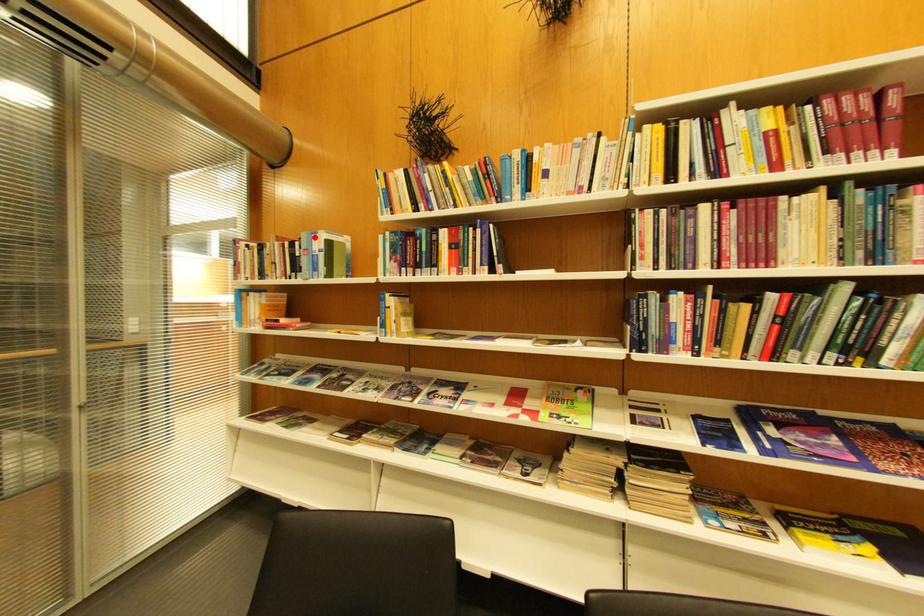
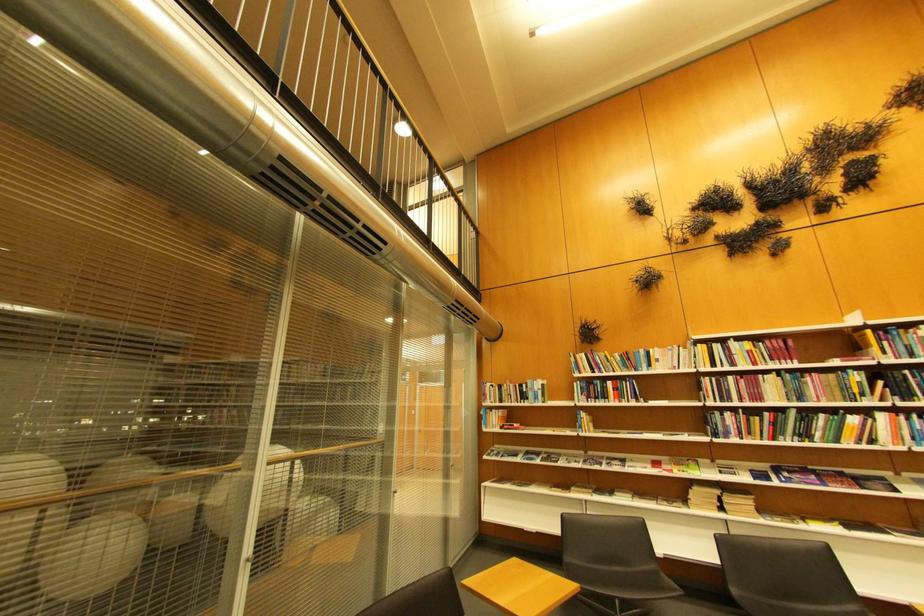
Locate, in the second image, the point that corresponds to the highlighted location in the first image.

(540, 383)